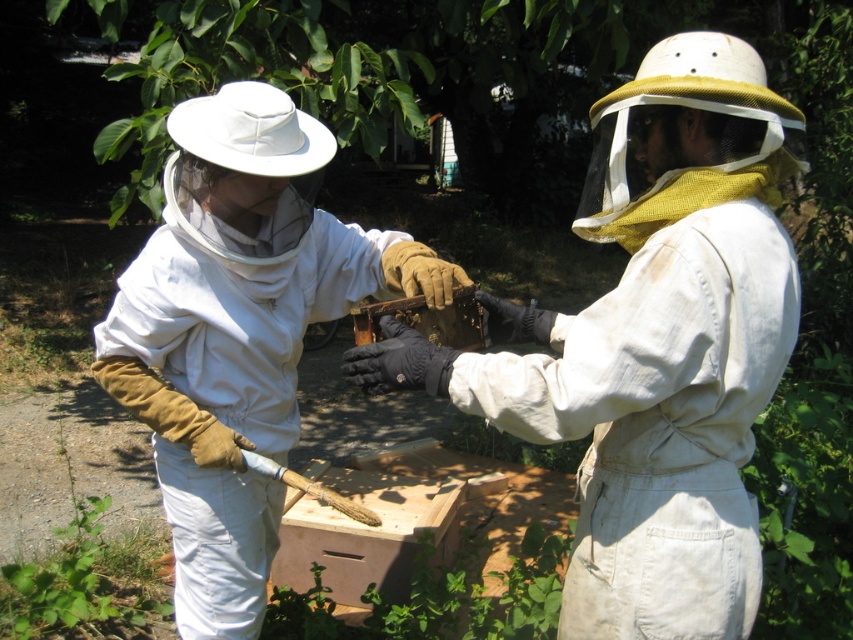
Question: Is the position of white matte beekeeper suit at center more distant than that of wooden honeycomb at center?

Choices:
 (A) no
 (B) yes

Answer: (B)

Question: Can you confirm if white cotton beekeeper suit at center is positioned to the left of wooden honeycomb at center?

Choices:
 (A) no
 (B) yes

Answer: (A)

Question: Which of these objects is positioned farthest from the white cotton beekeeper suit at center?

Choices:
 (A) wooden honeycomb at center
 (B) white matte beekeeper suit at center

Answer: (B)

Question: Which is farther from the white matte beekeeper suit at center?

Choices:
 (A) white cotton beekeeper suit at center
 (B) wooden honeycomb at center

Answer: (A)

Question: Which point is farther to the camera?

Choices:
 (A) wooden honeycomb at center
 (B) white matte beekeeper suit at center
 (C) white cotton beekeeper suit at center

Answer: (B)

Question: Is white matte beekeeper suit at center below wooden honeycomb at center?

Choices:
 (A) no
 (B) yes

Answer: (B)